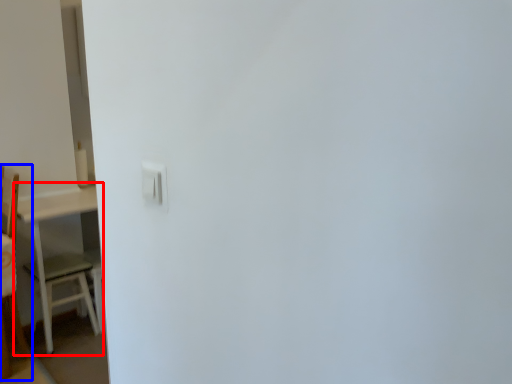
Question: Which object is further to the camera taking this photo, table (highlighted by a red box) or furniture (highlighted by a blue box)?

Choices:
 (A) table
 (B) furniture

Answer: (A)